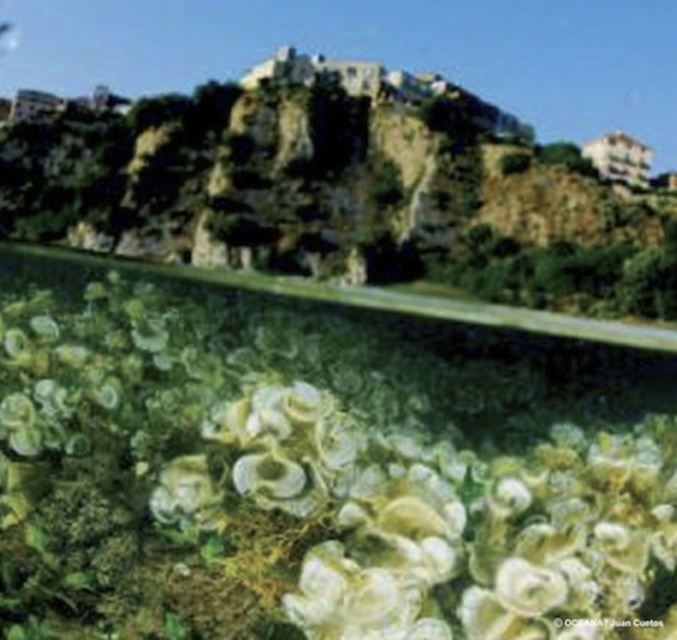
You are a landscape photographer planning to capture the white matte coral at center and the brown rocky hillside at upper center in a single frame. Based on their widths, which object should you position closer to the edge of the frame to ensure both fit without cropping?

Since the white matte coral at center is narrower than the brown rocky hillside at upper center, you should position the white matte coral at center closer to the edge of the frame to accommodate the wider brown rocky hillside at upper center within the frame.

You are standing at the base of the cliff in the coastal scene. You notice two points marked in the image. Which point, point (240,378) or point (37,202), is closer to your current position?

Point (240,378) is closer to the camera than point (37,202), so it is closer to your current position at the base of the cliff.

You are a marine biologist studying coral reefs. You observe the white matte coral at center in the image. Based on its position at coordinates point 0.739, 0.479, can you determine if it is located in the foreground or background of the scene?

The white matte coral at center is located at point [324,472]. Since the scene describes the foreground as a lush field of yellow flowers and the background as a rocky cliff, the coordinates place the white matte coral at center in the foreground where the flowers are.